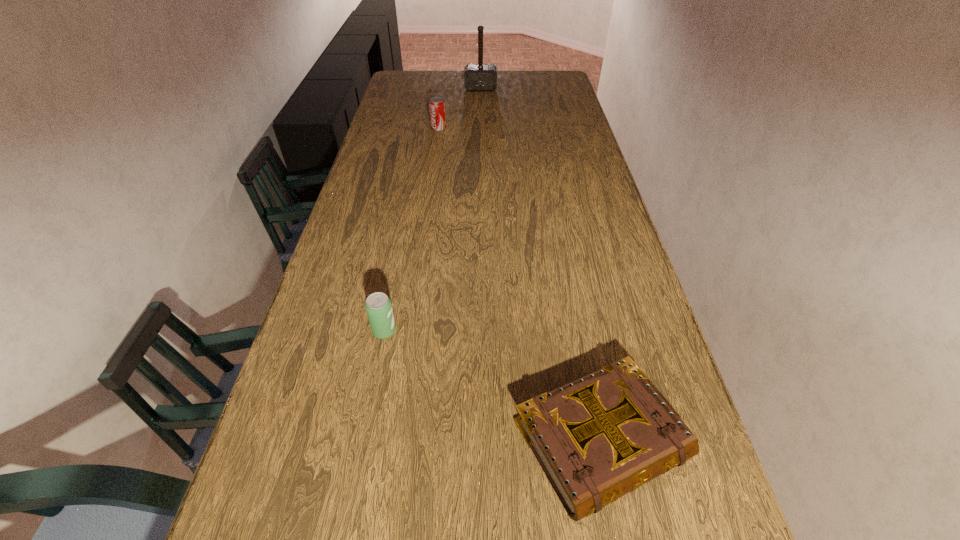
Locate an element on the screen. vacant region located 0.260m on the front of the left soda is located at coordinates (362, 450).

Identify the location of blank space located 0.210m on the left of the shortest object. (408, 440).

Locate an element on the screen. object located in the far edge section of the desktop is located at coordinates (477, 77).

Locate an element on the screen. The width and height of the screenshot is (960, 540). object located at the right edge is located at coordinates (597, 438).

This screenshot has width=960, height=540. Identify the location of vacant space at the far edge. (519, 70).

The image size is (960, 540). I want to click on free spot at the left edge of the desktop, so click(404, 184).

Where is `blank space at the right edge`? This screenshot has width=960, height=540. blank space at the right edge is located at coordinates (554, 130).

Where is `free space at the far right corner`? free space at the far right corner is located at coordinates (542, 80).

Where is `vacant point located between the shortest object and the third nearest object`? The width and height of the screenshot is (960, 540). vacant point located between the shortest object and the third nearest object is located at coordinates (519, 284).

Find the location of a particular element. The height and width of the screenshot is (540, 960). vacant point located between the hardback book and the farthest object is located at coordinates (540, 264).